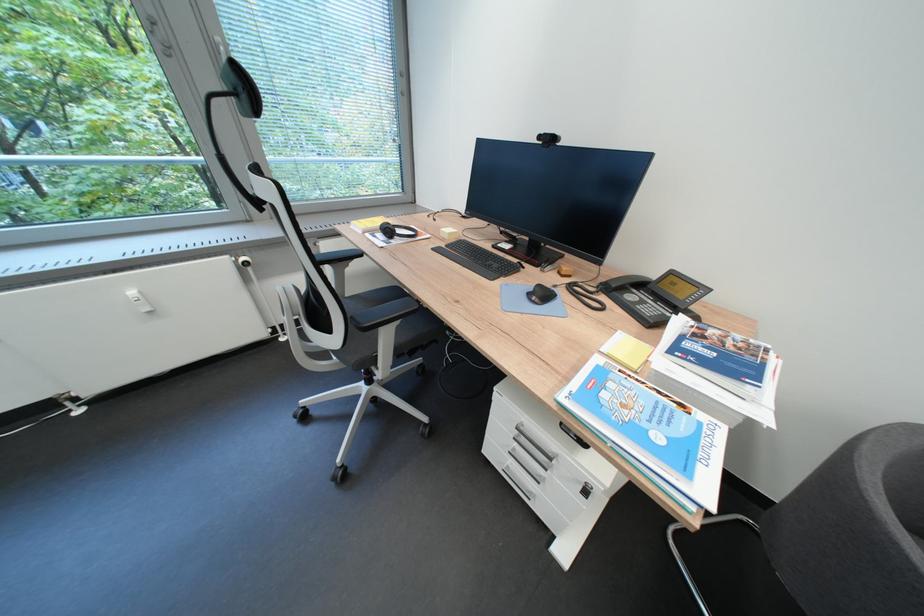
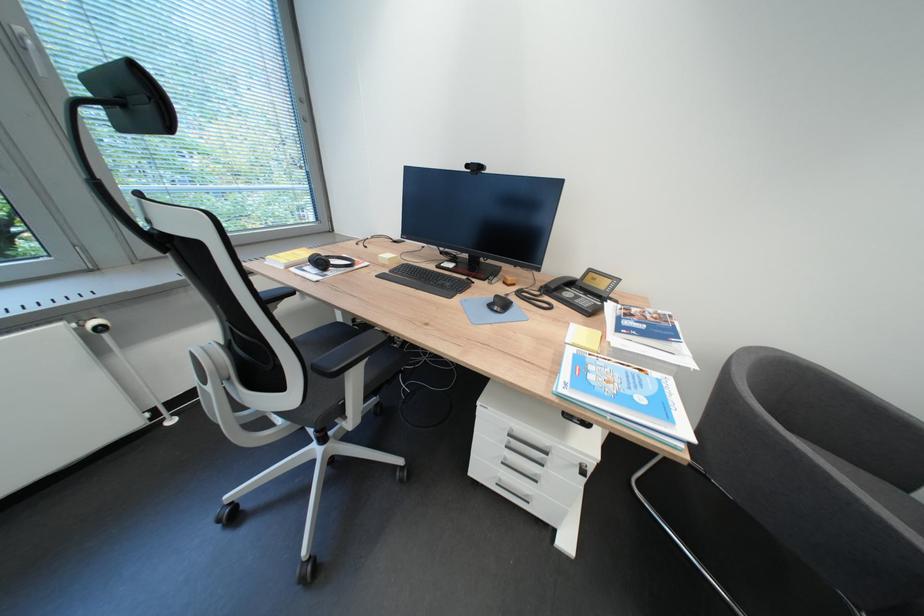
Locate, in the second image, the point that corresponds to point (643, 299) in the first image.

(580, 294)